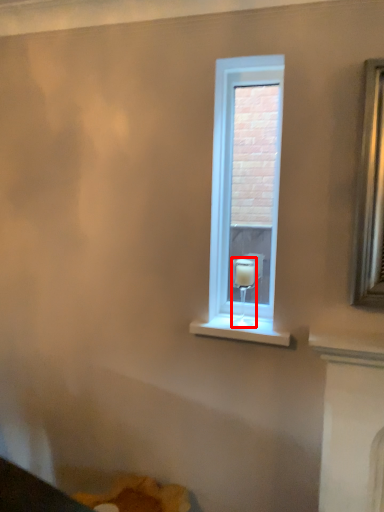
Question: Where is candle holder (annotated by the red box) located in relation to window in the image?

Choices:
 (A) left
 (B) right

Answer: (A)